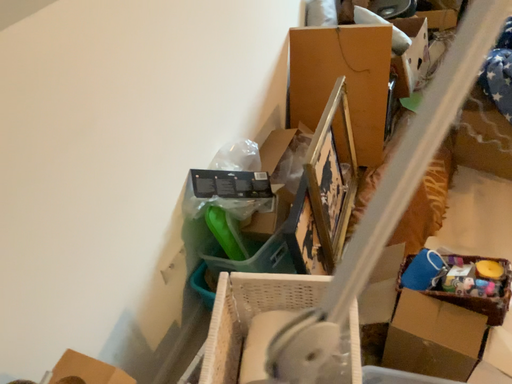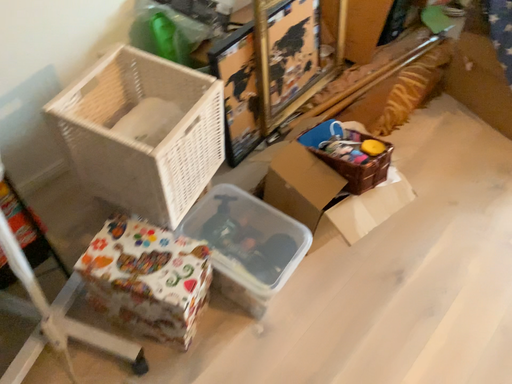
Question: Which way did the camera rotate in the video?

Choices:
 (A) rotated downward
 (B) rotated upward

Answer: (A)